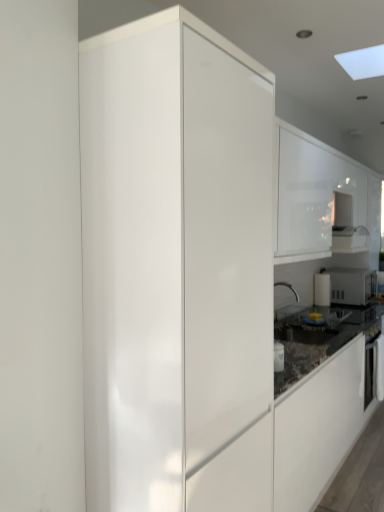
Question: From the image's perspective, is black glossy oven at right on white glossy microwave at right?

Choices:
 (A) yes
 (B) no

Answer: (B)

Question: Is white glossy microwave at right at the back of black glossy oven at right?

Choices:
 (A) no
 (B) yes

Answer: (A)

Question: Is black glossy oven at right positioned behind white glossy microwave at right?

Choices:
 (A) yes
 (B) no

Answer: (B)

Question: Is black glossy oven at right wider than white glossy microwave at right?

Choices:
 (A) yes
 (B) no

Answer: (B)

Question: Can you confirm if black glossy oven at right is positioned to the right of white glossy microwave at right?

Choices:
 (A) yes
 (B) no

Answer: (B)

Question: Considering the relative sizes of black glossy oven at right and white glossy microwave at right in the image provided, is black glossy oven at right thinner than white glossy microwave at right?

Choices:
 (A) yes
 (B) no

Answer: (A)

Question: Does glossy white cabinet at center, which appears as the first cabinetry when viewed from the left, come behind white glossy cabinet at upper right, which is the first cabinetry from right to left?

Choices:
 (A) yes
 (B) no

Answer: (B)

Question: Are glossy white cabinet at center, marked as the second cabinetry in a back-to-front arrangement, and white glossy cabinet at upper right, which is the first cabinetry from right to left, located far from each other?

Choices:
 (A) no
 (B) yes

Answer: (B)

Question: From a real-world perspective, is glossy white cabinet at center, which appears as the first cabinetry when viewed from the left, located beneath white glossy cabinet at upper right, which appears as the 2th cabinetry when viewed from the front?

Choices:
 (A) no
 (B) yes

Answer: (B)

Question: From the image's perspective, is glossy white cabinet at center, marked as the second cabinetry in a right-to-left arrangement, located above white glossy cabinet at upper right, which appears as the 2th cabinetry when viewed from the front?

Choices:
 (A) no
 (B) yes

Answer: (A)

Question: Does glossy white cabinet at center, which appears as the first cabinetry when viewed from the left, have a lesser width compared to white glossy cabinet at upper right, arranged as the 1th cabinetry when viewed from the back?

Choices:
 (A) yes
 (B) no

Answer: (B)

Question: Is glossy white cabinet at center, which appears as the first cabinetry when viewed from the left, facing away from white glossy cabinet at upper right, which is the first cabinetry from right to left?

Choices:
 (A) yes
 (B) no

Answer: (B)

Question: Is black glossy oven at right with white glossy cabinet at upper right, arranged as the 1th cabinetry when viewed from the back?

Choices:
 (A) yes
 (B) no

Answer: (B)